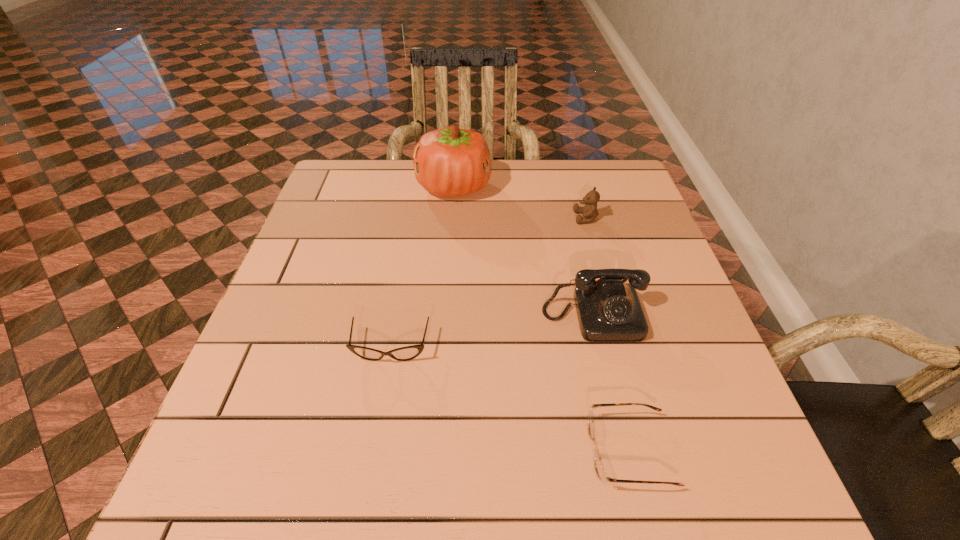
In order to click on vacant space located 0.200m on the dial of the second tallest object in this screenshot , I will do `click(623, 440)`.

Identify the location of vacant space located 0.380m on the front-facing side of the fourth nearest object. This screenshot has width=960, height=540. (429, 218).

Locate an element on the screen. The width and height of the screenshot is (960, 540). vacant space located 0.060m on the front-facing side of the fourth nearest object is located at coordinates (551, 218).

Image resolution: width=960 pixels, height=540 pixels. In order to click on free spot located on the front-facing side of the fourth nearest object in this screenshot , I will do `click(491, 218)`.

Find the location of a particular element. Image resolution: width=960 pixels, height=540 pixels. free space located 0.080m on the front-facing side of the left spectacles is located at coordinates (381, 403).

Locate an element on the screen. free space located on the front-facing side of the right spectacles is located at coordinates (418, 451).

This screenshot has width=960, height=540. I want to click on free location located 0.050m on the front-facing side of the right spectacles, so click(x=559, y=451).

This screenshot has width=960, height=540. Identify the location of free spot located 0.090m on the front-facing side of the right spectacles. (534, 451).

At what (x,y) coordinates should I click in order to perform the action: click on object that is at the far edge. Please return your answer as a coordinate pair (x, y). Image resolution: width=960 pixels, height=540 pixels. Looking at the image, I should click on (448, 162).

At what (x,y) coordinates should I click in order to perform the action: click on object that is at the near edge. Please return your answer as a coordinate pair (x, y). Looking at the image, I should click on (599, 468).